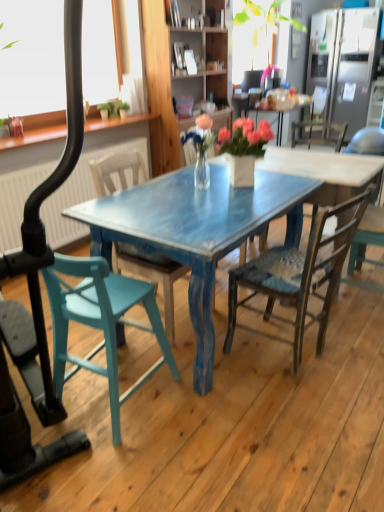
Question: Can you confirm if wooden cabinet at center is smaller than white matte window screen at upper left?

Choices:
 (A) no
 (B) yes

Answer: (A)

Question: Is white matte window screen at upper left surrounded by wooden cabinet at center?

Choices:
 (A) yes
 (B) no

Answer: (B)

Question: From the image's perspective, is wooden cabinet at center over white matte window screen at upper left?

Choices:
 (A) yes
 (B) no

Answer: (A)

Question: Does wooden cabinet at center have a lesser width compared to white matte window screen at upper left?

Choices:
 (A) no
 (B) yes

Answer: (B)

Question: Is the position of wooden cabinet at center less distant than that of white matte window screen at upper left?

Choices:
 (A) yes
 (B) no

Answer: (B)

Question: Choose the correct answer: Is rustic wood chair at center, the third chair positioned from the left, inside wooden cabinet at center or outside it?

Choices:
 (A) inside
 (B) outside

Answer: (B)

Question: From a real-world perspective, relative to wooden cabinet at center, is rustic wood chair at center, the third chair positioned from the left, vertically above or below?

Choices:
 (A) below
 (B) above

Answer: (A)

Question: Considering their positions, is rustic wood chair at center, which is the 2th chair from right to left, located in front of or behind wooden cabinet at center?

Choices:
 (A) behind
 (B) front

Answer: (B)

Question: Looking at their shapes, would you say rustic wood chair at center, the third chair positioned from the left, is wider or thinner than wooden cabinet at center?

Choices:
 (A) thin
 (B) wide

Answer: (B)

Question: Relative to white matte window screen at upper left, is teal painted wood chair at center, positioned as the second chair in left-to-right order, in front or behind?

Choices:
 (A) front
 (B) behind

Answer: (A)

Question: Looking at their shapes, would you say teal painted wood chair at center, positioned as the second chair in left-to-right order, is wider or thinner than white matte window screen at upper left?

Choices:
 (A) thin
 (B) wide

Answer: (B)

Question: Considering the positions of teal painted wood chair at center, positioned as the second chair in left-to-right order, and white matte window screen at upper left in the image, is teal painted wood chair at center, positioned as the second chair in left-to-right order, taller or shorter than white matte window screen at upper left?

Choices:
 (A) short
 (B) tall

Answer: (B)

Question: From a real-world perspective, relative to white matte window screen at upper left, is teal painted wood chair at center, positioned as the second chair in left-to-right order, vertically above or below?

Choices:
 (A) below
 (B) above

Answer: (A)

Question: Is rustic wood chair at center, which is the 2th chair from right to left, bigger or smaller than white matte window screen at upper left?

Choices:
 (A) big
 (B) small

Answer: (B)

Question: Is rustic wood chair at center, the third chair positioned from the left, inside or outside of white matte window screen at upper left?

Choices:
 (A) outside
 (B) inside

Answer: (A)